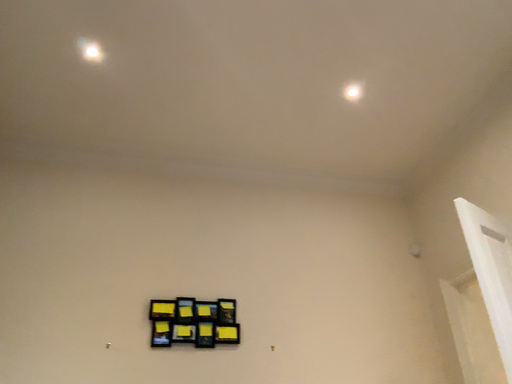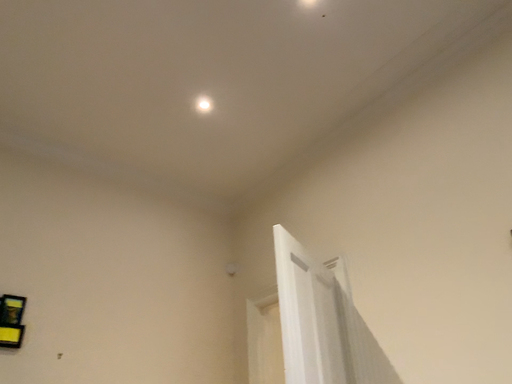
Question: How did the camera likely rotate when shooting the video?

Choices:
 (A) rotated left
 (B) rotated right

Answer: (B)